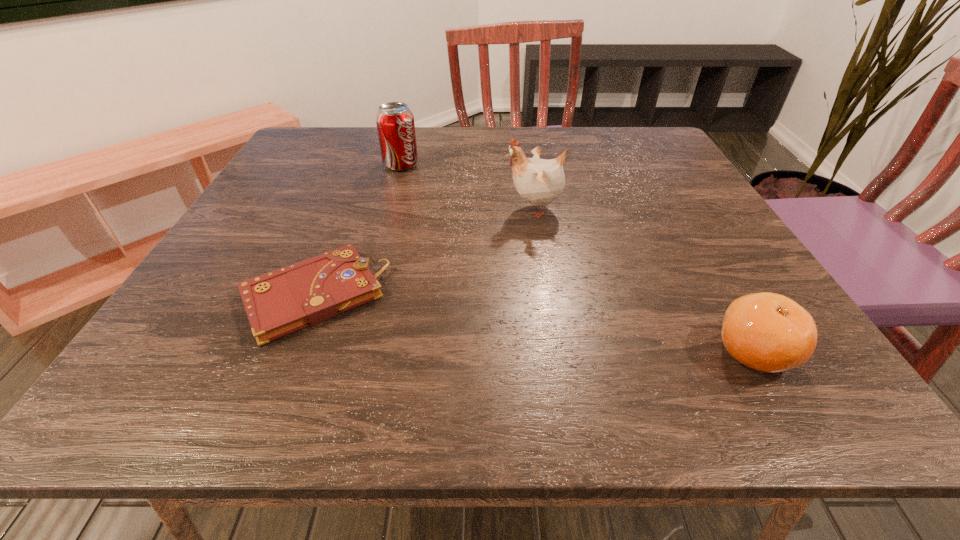
The image size is (960, 540). In order to click on the second object from right to left in this screenshot , I will do coord(539,181).

Locate an element on the screen. Image resolution: width=960 pixels, height=540 pixels. bird is located at coordinates (539, 181).

Find the location of a particular element. The height and width of the screenshot is (540, 960). the farthest object is located at coordinates (395, 124).

The width and height of the screenshot is (960, 540). Find the location of `the second shortest object`. the second shortest object is located at coordinates (768, 332).

In order to click on the rightmost object in this screenshot , I will do `click(768, 332)`.

Locate an element on the screen. This screenshot has width=960, height=540. the shortest object is located at coordinates (277, 303).

Identify the location of free location located 0.210m at the beak of the third object from left to right. (405, 208).

Find the location of a particular element. The height and width of the screenshot is (540, 960). vacant space located 0.170m at the beak of the third object from left to right is located at coordinates (423, 208).

The width and height of the screenshot is (960, 540). I want to click on free location located 0.130m at the beak of the third object from left to right, so click(x=443, y=208).

At what (x,y) coordinates should I click in order to perform the action: click on vacant position located 0.180m on the left of the soda can. Please return your answer as a coordinate pair (x, y). The height and width of the screenshot is (540, 960). Looking at the image, I should click on (310, 165).